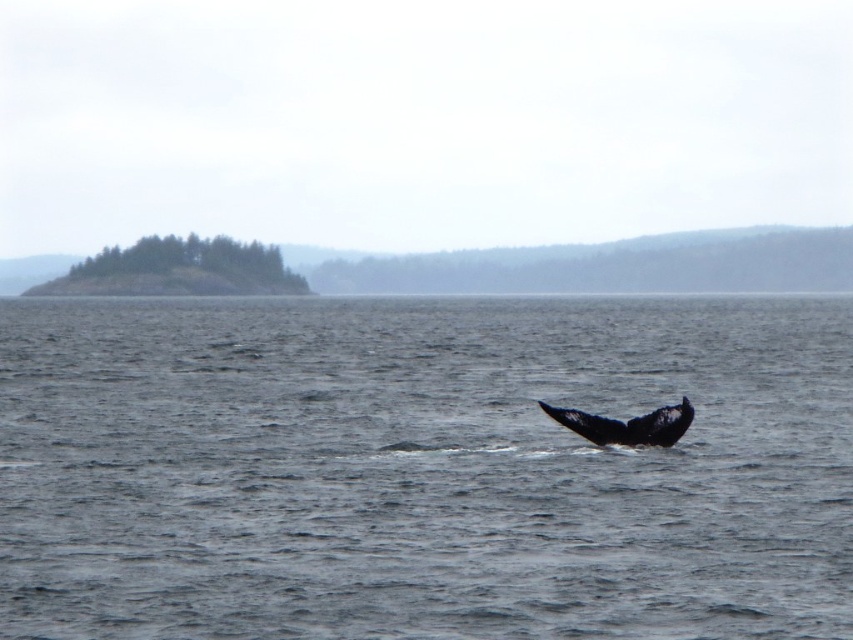
Question: Does dark gray water at center have a smaller size compared to black matte whale tail at lower right?

Choices:
 (A) no
 (B) yes

Answer: (A)

Question: Is dark gray water at center behind black matte whale tail at lower right?

Choices:
 (A) yes
 (B) no

Answer: (B)

Question: Can you confirm if dark gray water at center is positioned to the right of black matte whale tail at lower right?

Choices:
 (A) yes
 (B) no

Answer: (B)

Question: Which point is closer to the camera?

Choices:
 (A) (606, 444)
 (B) (688, 435)

Answer: (B)